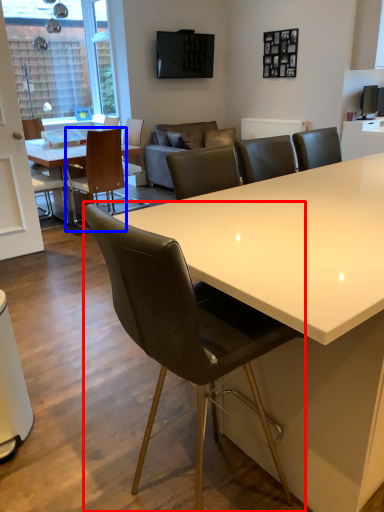
Question: Which of the following is the farthest to the observer, chair (highlighted by a red box) or chair (highlighted by a blue box)?

Choices:
 (A) chair
 (B) chair

Answer: (B)